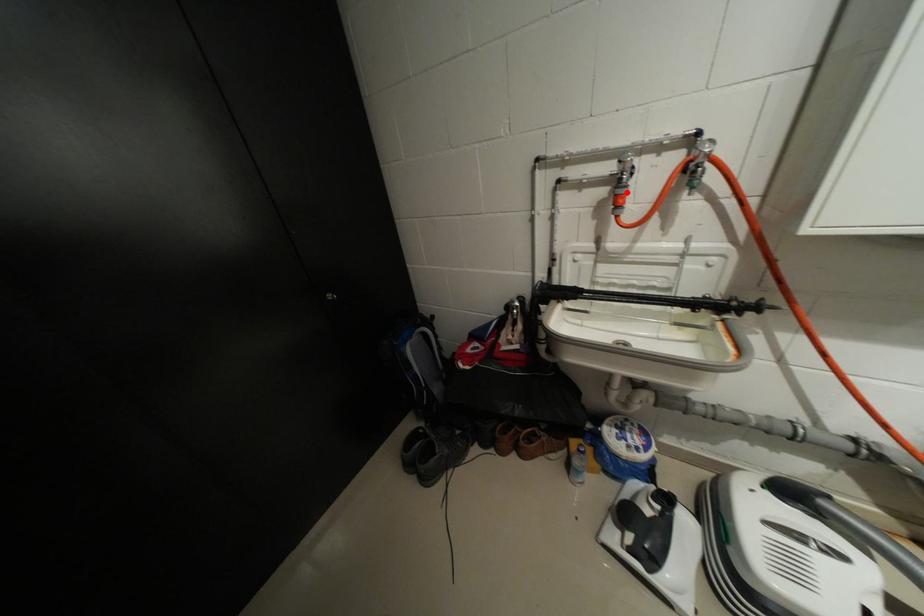
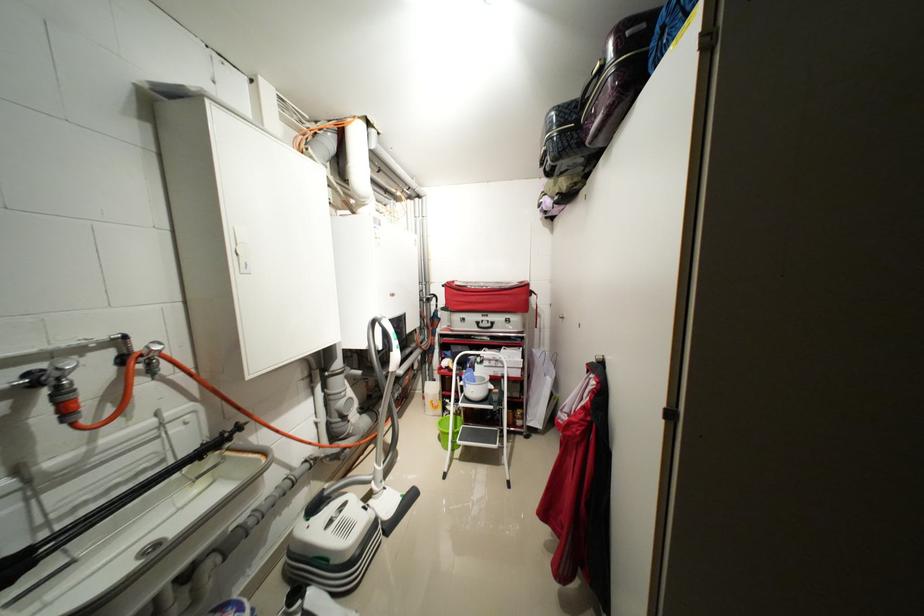
Locate, in the second image, the point that corresponds to the highlighted location in the first image.

(71, 399)